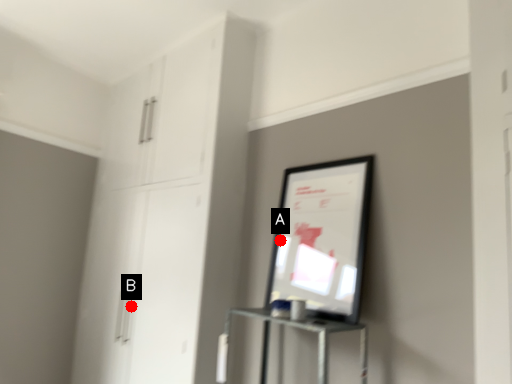
Question: Two points are circled on the image, labeled by A and B beside each circle. Which of the following is the closest to the observer?

Choices:
 (A) A is closer
 (B) B is closer

Answer: (A)